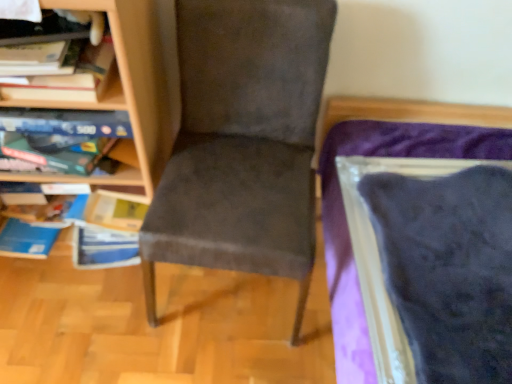
Question: From a real-world perspective, is suede-like gray chair at center physically located above or below wooden bookcase at left?

Choices:
 (A) below
 (B) above

Answer: (A)

Question: Considering the positions of suede-like gray chair at center and wooden bookcase at left in the image, is suede-like gray chair at center wider or thinner than wooden bookcase at left?

Choices:
 (A) wide
 (B) thin

Answer: (A)

Question: Considering the positions of suede-like gray chair at center and wooden bookcase at left in the image, is suede-like gray chair at center bigger or smaller than wooden bookcase at left?

Choices:
 (A) small
 (B) big

Answer: (A)

Question: Looking at the image, does wooden bookcase at left seem bigger or smaller compared to suede-like gray chair at center?

Choices:
 (A) small
 (B) big

Answer: (B)

Question: In terms of height, does wooden bookcase at left look taller or shorter compared to suede-like gray chair at center?

Choices:
 (A) tall
 (B) short

Answer: (A)

Question: In terms of width, does wooden bookcase at left look wider or thinner when compared to suede-like gray chair at center?

Choices:
 (A) thin
 (B) wide

Answer: (A)

Question: Does point (151, 56) appear closer or farther from the camera than point (322, 6)?

Choices:
 (A) farther
 (B) closer

Answer: (A)